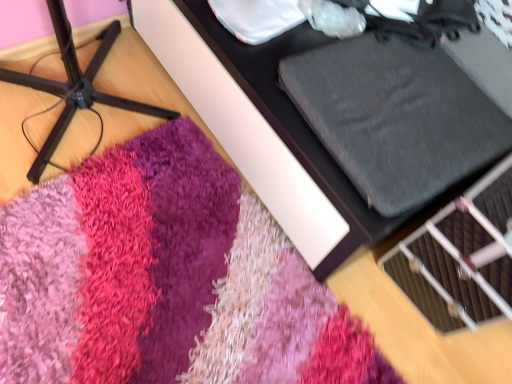
What do you see at coordinates (165, 279) in the screenshot? I see `shaggy pink rug at lower center` at bounding box center [165, 279].

The height and width of the screenshot is (384, 512). In order to click on textured gray cushion at upper right, the 2th furniture positioned from the left in this screenshot , I will do `click(264, 128)`.

Locate an element on the screen. This screenshot has width=512, height=384. shaggy pink rug at lower center is located at coordinates point(165,279).

From the image's perspective, is textured gray cushion at upper right, arranged as the 1th furniture when viewed from the right, beneath shaggy pink rug at lower center?

No.

Looking at their sizes, would you say textured gray cushion at upper right, arranged as the 1th furniture when viewed from the right, is wider or thinner than shaggy pink rug at lower center?

Clearly, textured gray cushion at upper right, arranged as the 1th furniture when viewed from the right, has less width compared to shaggy pink rug at lower center.

Relative to shaggy pink rug at lower center, is textured gray cushion at upper right, the 2th furniture positioned from the left, in front or behind?

textured gray cushion at upper right, the 2th furniture positioned from the left, is positioned farther from the viewer than shaggy pink rug at lower center.

Is textured gray cushion at upper right, arranged as the 1th furniture when viewed from the right, to the left or to the right of shaggy pink rug at lower center in the image?

From the image, it's evident that textured gray cushion at upper right, arranged as the 1th furniture when viewed from the right, is to the right of shaggy pink rug at lower center.

How far apart are shaggy pink rug at lower center and shaggy carpet at lower left, arranged as the second furniture when viewed from the right?

A distance of 15.66 inches exists between shaggy pink rug at lower center and shaggy carpet at lower left, arranged as the second furniture when viewed from the right.

Locate an element on the screen. The width and height of the screenshot is (512, 384). furniture that is the 1st one when counting upward from the shaggy pink rug at lower center (from the image's perspective) is located at coordinates (75, 85).

From the image's perspective, is shaggy pink rug at lower center positioned above or below shaggy carpet at lower left, arranged as the second furniture when viewed from the right?

Clearly, from the image's perspective, shaggy pink rug at lower center is below shaggy carpet at lower left, arranged as the second furniture when viewed from the right.

Would you say shaggy pink rug at lower center is a long distance from shaggy carpet at lower left, the 1th furniture positioned from the left?

No, shaggy pink rug at lower center is in close proximity to shaggy carpet at lower left, the 1th furniture positioned from the left.

Does textured gray cushion at upper right, the 2th furniture positioned from the left, touch shaggy carpet at lower left, the 1th furniture positioned from the left?

No, textured gray cushion at upper right, the 2th furniture positioned from the left, is not beside shaggy carpet at lower left, the 1th furniture positioned from the left.

Based on the photo, who is smaller, textured gray cushion at upper right, arranged as the 1th furniture when viewed from the right, or shaggy carpet at lower left, the 1th furniture positioned from the left?

shaggy carpet at lower left, the 1th furniture positioned from the left.

Considering the sizes of textured gray cushion at upper right, the 2th furniture positioned from the left, and shaggy carpet at lower left, arranged as the second furniture when viewed from the right, in the image, is textured gray cushion at upper right, the 2th furniture positioned from the left, taller or shorter than shaggy carpet at lower left, arranged as the second furniture when viewed from the right,?

In the image, textured gray cushion at upper right, the 2th furniture positioned from the left, appears to be shorter than shaggy carpet at lower left, arranged as the second furniture when viewed from the right.

From the image's perspective, which one is positioned higher, shaggy pink rug at lower center or textured gray cushion at upper right, arranged as the 1th furniture when viewed from the right?

textured gray cushion at upper right, arranged as the 1th furniture when viewed from the right.

Does shaggy pink rug at lower center have a smaller size compared to textured gray cushion at upper right, arranged as the 1th furniture when viewed from the right?

Correct, shaggy pink rug at lower center occupies less space than textured gray cushion at upper right, arranged as the 1th furniture when viewed from the right.

Considering the positions of objects shaggy pink rug at lower center and textured gray cushion at upper right, arranged as the 1th furniture when viewed from the right, in the image provided, who is behind, shaggy pink rug at lower center or textured gray cushion at upper right, arranged as the 1th furniture when viewed from the right,?

textured gray cushion at upper right, arranged as the 1th furniture when viewed from the right, is behind.

Which is more to the right, shaggy carpet at lower left, the 1th furniture positioned from the left, or shaggy pink rug at lower center?

From the viewer's perspective, shaggy pink rug at lower center appears more on the right side.

Who is shorter, shaggy carpet at lower left, the 1th furniture positioned from the left, or shaggy pink rug at lower center?

With less height is shaggy pink rug at lower center.

Considering the positions of point (101, 59) and point (221, 279), is point (101, 59) closer or farther from the camera than point (221, 279)?

Clearly, point (101, 59) is more distant from the camera than point (221, 279).

From the image's perspective, which is below, shaggy carpet at lower left, the 1th furniture positioned from the left, or shaggy pink rug at lower center?

shaggy pink rug at lower center, from the image's perspective.

Would you say shaggy carpet at lower left, the 1th furniture positioned from the left, is outside textured gray cushion at upper right, arranged as the 1th furniture when viewed from the right?

Yes.

What's the angular difference between shaggy carpet at lower left, arranged as the second furniture when viewed from the right, and textured gray cushion at upper right, the 2th furniture positioned from the left,'s facing directions?

The angle between the facing direction of shaggy carpet at lower left, arranged as the second furniture when viewed from the right, and the facing direction of textured gray cushion at upper right, the 2th furniture positioned from the left, is 90 degrees.

In the scene shown: From the image's perspective, which is below, shaggy carpet at lower left, arranged as the second furniture when viewed from the right, or textured gray cushion at upper right, arranged as the 1th furniture when viewed from the right?

shaggy carpet at lower left, arranged as the second furniture when viewed from the right.

Between shaggy carpet at lower left, the 1th furniture positioned from the left, and textured gray cushion at upper right, arranged as the 1th furniture when viewed from the right, which one has more height?

With more height is shaggy carpet at lower left, the 1th furniture positioned from the left.

Image resolution: width=512 pixels, height=384 pixels. Identify the location of mat below the textured gray cushion at upper right, arranged as the 1th furniture when viewed from the right (from the image's perspective). (165, 279).

Identify the location of mat below the shaggy carpet at lower left, arranged as the second furniture when viewed from the right (from a real-world perspective). (165, 279).

From the image, which object appears to be nearer to textured gray cushion at upper right, the 2th furniture positioned from the left, shaggy carpet at lower left, the 1th furniture positioned from the left, or shaggy pink rug at lower center?

shaggy pink rug at lower center.

Based on their spatial positions, is shaggy pink rug at lower center or textured gray cushion at upper right, the 2th furniture positioned from the left, further from shaggy carpet at lower left, the 1th furniture positioned from the left?

shaggy pink rug at lower center lies further to shaggy carpet at lower left, the 1th furniture positioned from the left, than the other object.

Considering their positions, is textured gray cushion at upper right, arranged as the 1th furniture when viewed from the right, positioned further to shaggy carpet at lower left, the 1th furniture positioned from the left, than shaggy pink rug at lower center?

shaggy pink rug at lower center is positioned further to the anchor shaggy carpet at lower left, the 1th furniture positioned from the left.

From the image, which object appears to be farther from textured gray cushion at upper right, the 2th furniture positioned from the left, shaggy pink rug at lower center or shaggy carpet at lower left, arranged as the second furniture when viewed from the right?

shaggy carpet at lower left, arranged as the second furniture when viewed from the right, is further to textured gray cushion at upper right, the 2th furniture positioned from the left.

Estimate the real-world distances between objects in this image. Which object is further from shaggy pink rug at lower center, shaggy carpet at lower left, the 1th furniture positioned from the left, or textured gray cushion at upper right, arranged as the 1th furniture when viewed from the right?

Among the two, shaggy carpet at lower left, the 1th furniture positioned from the left, is located further to shaggy pink rug at lower center.

Considering their positions, is textured gray cushion at upper right, the 2th furniture positioned from the left, positioned closer to shaggy pink rug at lower center than shaggy carpet at lower left, the 1th furniture positioned from the left?

Based on the image, textured gray cushion at upper right, the 2th furniture positioned from the left, appears to be nearer to shaggy pink rug at lower center.

At what (x,y) coordinates should I click in order to perform the action: click on mat located between shaggy carpet at lower left, arranged as the second furniture when viewed from the right, and textured gray cushion at upper right, arranged as the 1th furniture when viewed from the right, in the left-right direction. Please return your answer as a coordinate pair (x, y). Looking at the image, I should click on (165, 279).